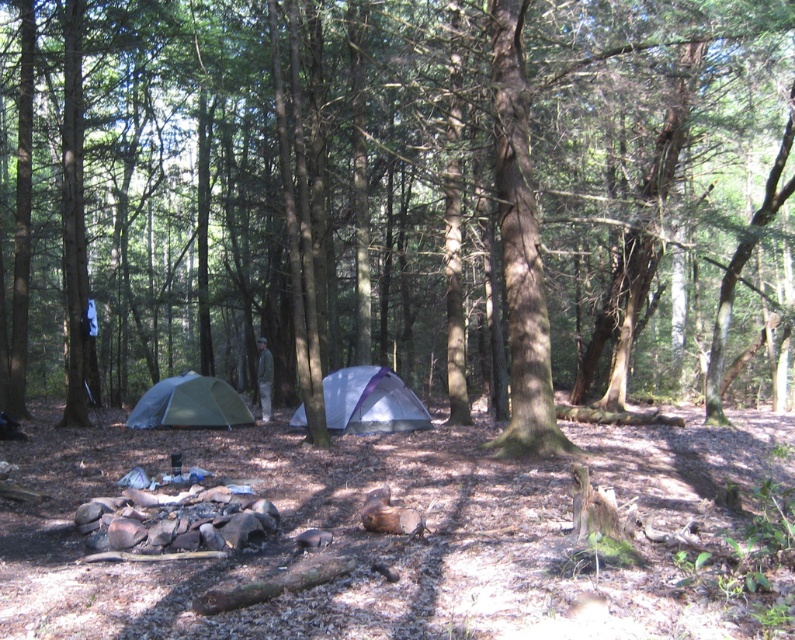
Which is above, brown rough tree at center or silver metallic tent at center?

brown rough tree at center is above.

Who is more forward, (238,148) or (394,374)?

Point (394,374)

I want to click on brown rough tree at center, so click(400, 198).

Between brown rough tree at center and green fabric tent at center, which one has less height?

With less height is green fabric tent at center.

What do you see at coordinates (400, 198) in the screenshot? The image size is (795, 640). I see `brown rough tree at center` at bounding box center [400, 198].

Measure the distance between brown rough tree at center and camera.

brown rough tree at center and camera are 10.52 meters apart.

The height and width of the screenshot is (640, 795). In order to click on brown rough tree at center in this screenshot , I will do `click(400, 198)`.

Measure the distance between silver metallic tent at center and camera.

A distance of 16.34 meters exists between silver metallic tent at center and camera.

Does silver metallic tent at center have a smaller size compared to green fabric tent at center?

No, silver metallic tent at center is not smaller than green fabric tent at center.

Which is behind, point (390, 426) or point (130, 412)?

Point (130, 412)

Find the location of a particular element. silver metallic tent at center is located at coordinates (370, 401).